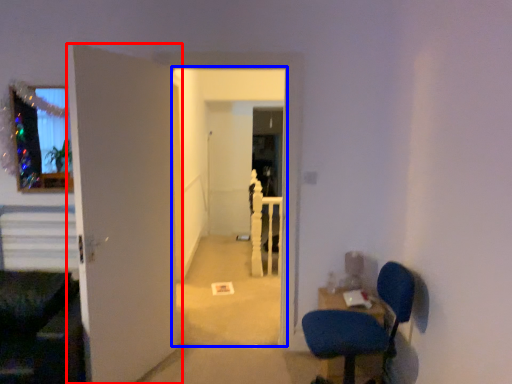
Question: Among these objects, which one is nearest to the camera, door (highlighted by a red box) or corridor (highlighted by a blue box)?

Choices:
 (A) door
 (B) corridor

Answer: (A)